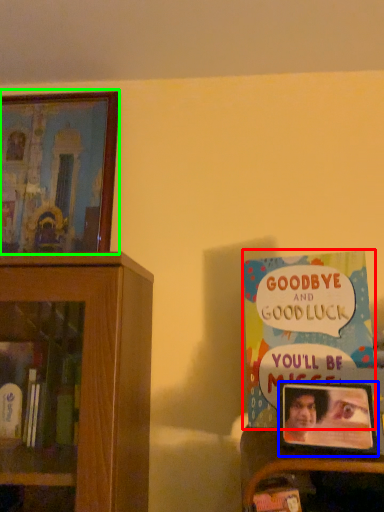
Question: Which object is positioned closest to book (highlighted by a red box)? Select from picture frame (highlighted by a blue box) and picture frame (highlighted by a green box).

Choices:
 (A) picture frame
 (B) picture frame

Answer: (A)